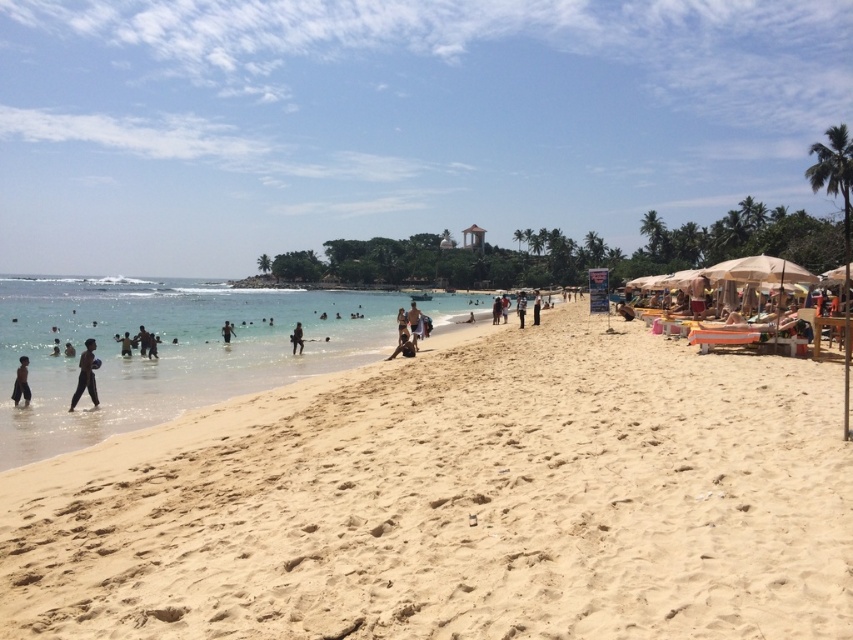
Question: Which object is positioned closest to the dark skin person at lower left?

Choices:
 (A) white cotton shirt at center
 (B) light beige sand at center
 (C) dark skin person at lower center

Answer: (C)

Question: Does dark skin human at left appear under light brown skin at center?

Choices:
 (A) no
 (B) yes

Answer: (B)

Question: Can you confirm if dark skin human at lower left is wider than white cotton shirt at center?

Choices:
 (A) yes
 (B) no

Answer: (B)

Question: Can you confirm if dark skin human at lower left is positioned to the left of dark blue fabric at center?

Choices:
 (A) yes
 (B) no

Answer: (A)

Question: Which of the following is the closest to the observer?

Choices:
 (A) (227, 324)
 (B) (126, 342)
 (C) (337, 516)
 (D) (415, 336)

Answer: (C)

Question: Estimate the real-world distances between objects in this image. Which object is farther from the dark skin person at lower center?

Choices:
 (A) light beige sand at center
 (B) dark blue fabric at center

Answer: (A)